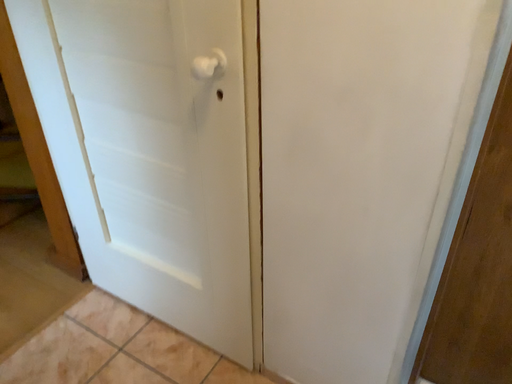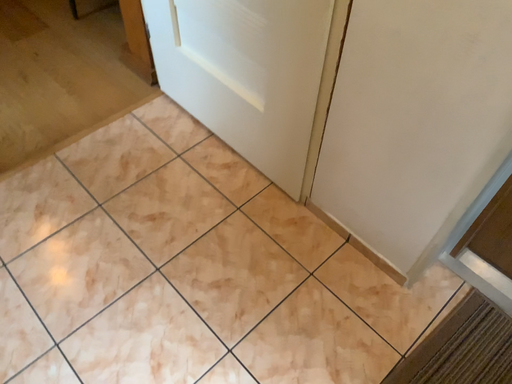
Question: Which way did the camera rotate in the video?

Choices:
 (A) rotated downward
 (B) rotated upward

Answer: (A)